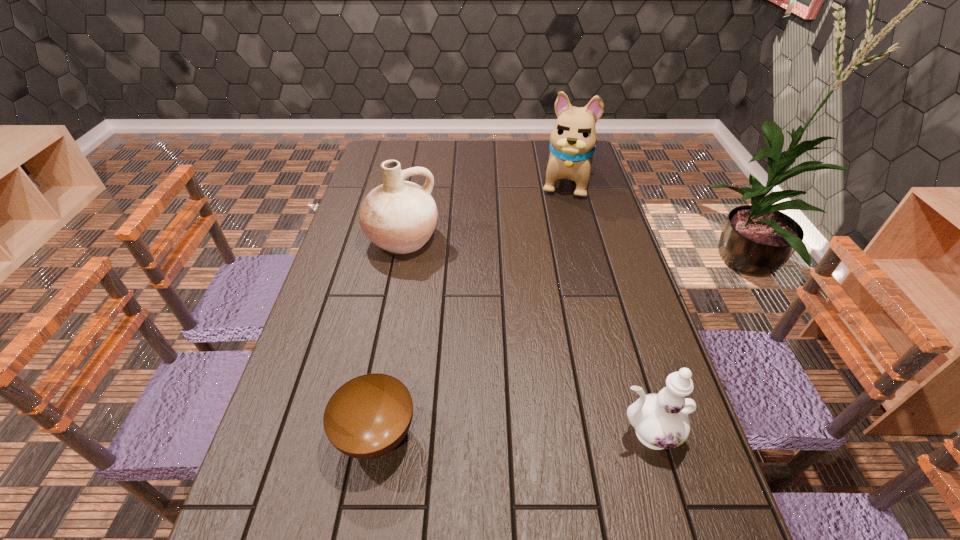
I want to click on puppy that is positioned at the right edge, so click(x=572, y=141).

This screenshot has width=960, height=540. In order to click on object that is positioned at the near left corner in this screenshot , I will do `click(367, 417)`.

In order to click on object at the far right corner in this screenshot , I will do click(572, 141).

In the image, there is a desktop. What are the coordinates of `vacant space at the far edge` in the screenshot? It's located at [516, 144].

In the image, there is a desktop. Where is `vacant space at the left edge`? vacant space at the left edge is located at coordinates (363, 185).

The height and width of the screenshot is (540, 960). In the image, there is a desktop. In order to click on free space at the right edge in this screenshot , I will do `click(650, 336)`.

The width and height of the screenshot is (960, 540). I want to click on vacant space that's between the farthest object and the bowl, so click(470, 308).

The height and width of the screenshot is (540, 960). What are the coordinates of `vacant space in between the chinaware and the tallest object` in the screenshot? It's located at (605, 307).

Image resolution: width=960 pixels, height=540 pixels. I want to click on vacant space in between the chinaware and the third nearest object, so click(524, 336).

Identify the location of empty space between the farthest object and the chinaware. (605, 307).